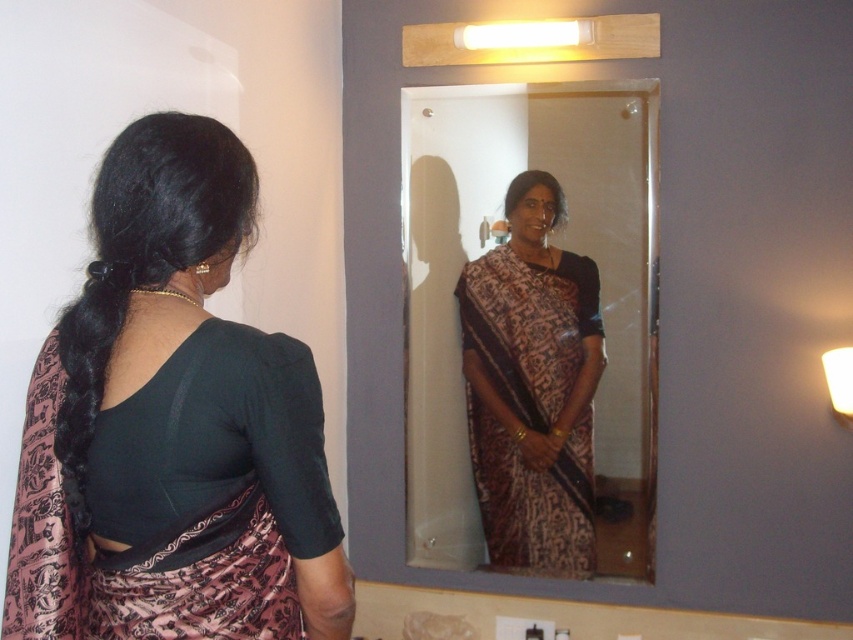
Is point (480, 304) positioned before point (552, 310)?

No, (480, 304) is behind (552, 310).

Between matte glass mirror at center and brown printed saree at center, which one has less height?

With less height is brown printed saree at center.

I want to click on matte glass mirror at center, so click(x=531, y=324).

Is matte black blouse at center shorter than matte glass mirror at center?

Yes, matte black blouse at center is shorter than matte glass mirror at center.

Can you confirm if matte black blouse at center is positioned below matte glass mirror at center?

Correct, matte black blouse at center is located below matte glass mirror at center.

Which is behind, point (248, 557) or point (635, 244)?

The point (635, 244) is behind.

Identify the location of matte black blouse at center. This screenshot has width=853, height=640. (173, 426).

Is point (250, 374) behind point (502, 552)?

That is False.

Find the location of `matte black blouse at center`. matte black blouse at center is located at coordinates (173, 426).